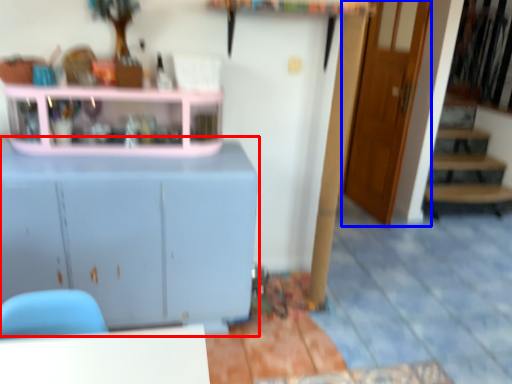
Question: Which of the following is the farthest to the observer, cabinetry (highlighted by a red box) or door (highlighted by a blue box)?

Choices:
 (A) cabinetry
 (B) door

Answer: (B)